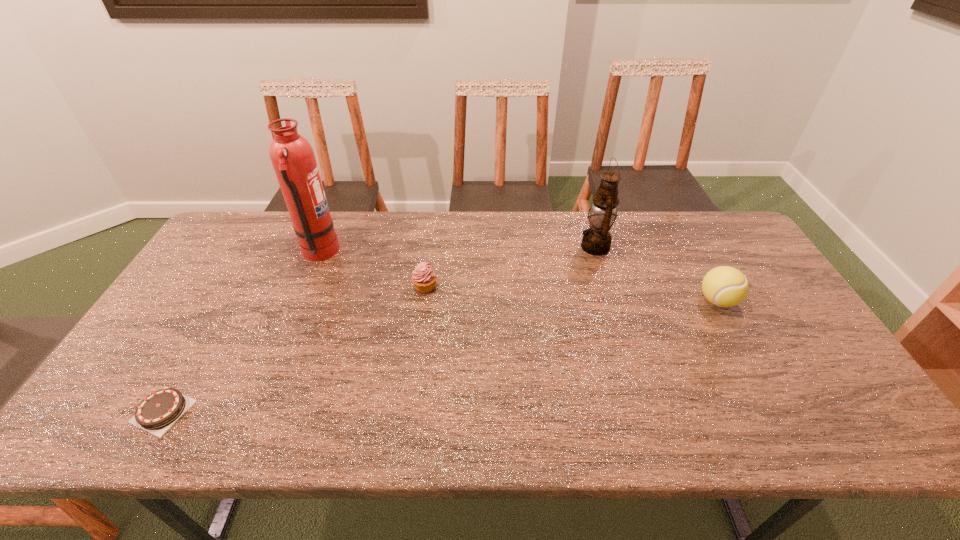
Locate an element on the screen. The height and width of the screenshot is (540, 960). object located at the near left corner is located at coordinates (156, 413).

The width and height of the screenshot is (960, 540). In the image, there is a desktop. Find the location of `vacant space at the far edge`. vacant space at the far edge is located at coordinates (646, 218).

Find the location of a particular element. free point at the near edge is located at coordinates click(x=364, y=415).

Find the location of a particular element. The width and height of the screenshot is (960, 540). vacant point at the left edge is located at coordinates (210, 255).

You are a GUI agent. You are given a task and a screenshot of the screen. Output one action in this format:
    pyautogui.click(x=<x>, y=<y>)
    Task: Click on the vacant point at the right edge
    Image resolution: width=960 pixels, height=540 pixels.
    Given the screenshot: What is the action you would take?
    pyautogui.click(x=795, y=327)

The image size is (960, 540). In order to click on free region at the far left corner of the desktop in this screenshot , I will do `click(230, 240)`.

In the image, there is a desktop. Where is `vacant space at the far right corner`? vacant space at the far right corner is located at coordinates (716, 254).

Locate an element on the screen. The image size is (960, 540). vacant area that lies between the cupcake and the second object from left to right is located at coordinates (372, 270).

Locate an element on the screen. The width and height of the screenshot is (960, 540). free space that is in between the leftmost object and the third shortest object is located at coordinates (440, 356).

Where is `vacant area that lies between the oil lamp and the second object from left to right`? The width and height of the screenshot is (960, 540). vacant area that lies between the oil lamp and the second object from left to right is located at coordinates (457, 249).